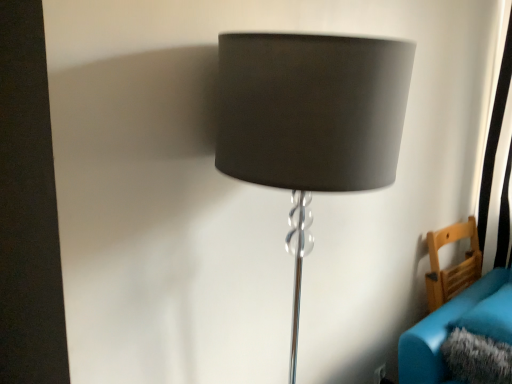
This screenshot has height=384, width=512. What do you see at coordinates (452, 266) in the screenshot?
I see `wooden chair at lower right` at bounding box center [452, 266].

The image size is (512, 384). Identify the location of wooden chair at lower right. (452, 266).

The width and height of the screenshot is (512, 384). Find the location of `velvet teal couch at lower right`. velvet teal couch at lower right is located at coordinates (456, 325).

Where is `matte gray lampshade at center`? The width and height of the screenshot is (512, 384). matte gray lampshade at center is located at coordinates (311, 121).

This screenshot has width=512, height=384. What are the coordinates of `wooden chair at lower right` in the screenshot? It's located at (452, 266).

Considering the relative positions of matte gray lampshade at center and velvet teal couch at lower right in the image provided, is matte gray lampshade at center to the right of velvet teal couch at lower right from the viewer's perspective?

No, matte gray lampshade at center is not to the right of velvet teal couch at lower right.

Who is bigger, matte gray lampshade at center or velvet teal couch at lower right?

matte gray lampshade at center is bigger.

Is matte gray lampshade at center positioned with its back to velvet teal couch at lower right?

That's not correct — matte gray lampshade at center is not looking away from velvet teal couch at lower right.

From a real-world perspective, is matte gray lampshade at center located beneath velvet teal couch at lower right?

No, from a real-world perspective, matte gray lampshade at center is not below velvet teal couch at lower right.

Which object is further away from the camera, wooden chair at lower right or velvet teal couch at lower right?

wooden chair at lower right is further from the camera.

Looking at this image, from the image's perspective, between wooden chair at lower right and velvet teal couch at lower right, which one is located above?

wooden chair at lower right, from the image's perspective.

Considering the sizes of objects wooden chair at lower right and velvet teal couch at lower right in the image provided, who is bigger, wooden chair at lower right or velvet teal couch at lower right?

wooden chair at lower right is bigger.

Is wooden chair at lower right surrounded by velvet teal couch at lower right?

No, wooden chair at lower right is not inside velvet teal couch at lower right.

Between velvet teal couch at lower right and wooden chair at lower right, which one has more height?

wooden chair at lower right.

From the picture: Who is bigger, velvet teal couch at lower right or wooden chair at lower right?

With larger size is wooden chair at lower right.

Locate an element on the screen. The image size is (512, 384). couch beneath the wooden chair at lower right (from a real-world perspective) is located at coordinates (456, 325).

Looking at this image, which of these two, velvet teal couch at lower right or matte gray lampshade at center, is smaller?

velvet teal couch at lower right.

From the image's perspective, is velvet teal couch at lower right positioned above or below matte gray lampshade at center?

Based on their image positions, velvet teal couch at lower right is located beneath matte gray lampshade at center.

In terms of height, does velvet teal couch at lower right look taller or shorter compared to matte gray lampshade at center?

In the image, velvet teal couch at lower right appears to be shorter than matte gray lampshade at center.

Based on the photo, which of these two, wooden chair at lower right or matte gray lampshade at center, stands taller?

matte gray lampshade at center.

Who is bigger, wooden chair at lower right or matte gray lampshade at center?

matte gray lampshade at center is bigger.

Is the position of wooden chair at lower right more distant than that of matte gray lampshade at center?

Yes.

The image size is (512, 384). What are the coordinates of `lamp on the left of wooden chair at lower right` in the screenshot? It's located at (311, 121).

In terms of width, does matte gray lampshade at center look wider or thinner when compared to wooden chair at lower right?

Clearly, matte gray lampshade at center has more width compared to wooden chair at lower right.

Does matte gray lampshade at center come behind wooden chair at lower right?

No.

Choose the correct answer: Is matte gray lampshade at center inside wooden chair at lower right or outside it?

matte gray lampshade at center is outside wooden chair at lower right.

In the image, there is a matte gray lampshade at center. Identify the location of couch below it (from a real-world perspective). The width and height of the screenshot is (512, 384). (456, 325).

Find the location of a particular element. furniture that is on the right side of velvet teal couch at lower right is located at coordinates (452, 266).

Based on their spatial positions, is velvet teal couch at lower right or wooden chair at lower right closer to matte gray lampshade at center?

velvet teal couch at lower right lies closer to matte gray lampshade at center than the other object.

Based on their spatial positions, is matte gray lampshade at center or wooden chair at lower right further from velvet teal couch at lower right?

Among the two, matte gray lampshade at center is located further to velvet teal couch at lower right.

Considering their positions, is matte gray lampshade at center positioned further to wooden chair at lower right than velvet teal couch at lower right?

matte gray lampshade at center.

Estimate the real-world distances between objects in this image. Which object is closer to wooden chair at lower right, velvet teal couch at lower right or matte gray lampshade at center?

The object closer to wooden chair at lower right is velvet teal couch at lower right.

Estimate the real-world distances between objects in this image. Which object is closer to matte gray lampshade at center, wooden chair at lower right or velvet teal couch at lower right?

The object closer to matte gray lampshade at center is velvet teal couch at lower right.

Looking at the image, which one is located closer to velvet teal couch at lower right, wooden chair at lower right or matte gray lampshade at center?

wooden chair at lower right lies closer to velvet teal couch at lower right than the other object.

Where is `couch between matte gray lampshade at center and wooden chair at lower right from front to back`? couch between matte gray lampshade at center and wooden chair at lower right from front to back is located at coordinates (456, 325).